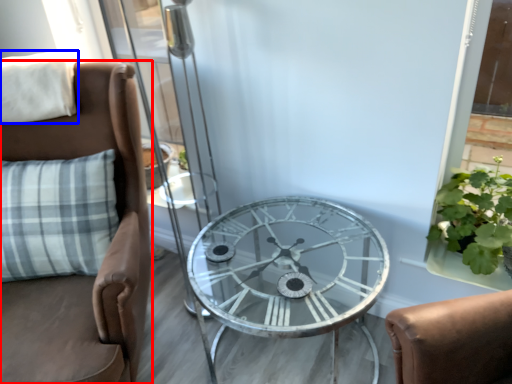
Question: Among these objects, which one is nearest to the camera, chair (highlighted by a red box) or pillow (highlighted by a blue box)?

Choices:
 (A) chair
 (B) pillow

Answer: (A)